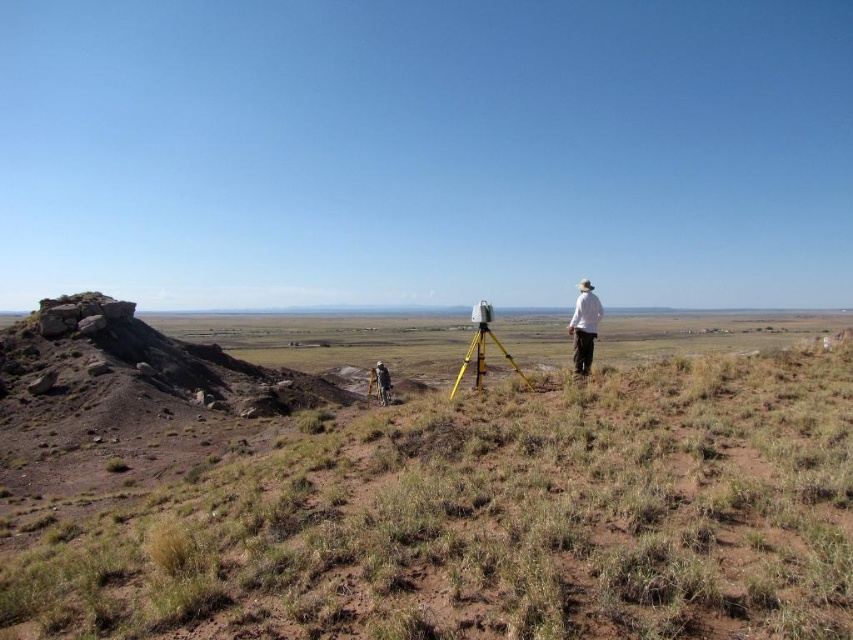
Can you confirm if dry grass at center is smaller than white matte shirt at right?

Actually, dry grass at center might be larger than white matte shirt at right.

Which is above, dry grass at center or white matte shirt at right?

white matte shirt at right is higher up.

You are a GUI agent. You are given a task and a screenshot of the screen. Output one action in this format:
    pyautogui.click(x=<x>, y=<y>)
    Task: Click on the dry grass at center
    The image size is (853, 640).
    Given the screenshot: What is the action you would take?
    pyautogui.click(x=416, y=497)

This screenshot has height=640, width=853. In order to click on dry grass at center in this screenshot , I will do `click(416, 497)`.

Between dry grass at center and yellow metallic tripod at center, which one has less height?

With less height is yellow metallic tripod at center.

Which is in front, point (337, 627) or point (483, 356)?

Point (337, 627)

This screenshot has height=640, width=853. In order to click on dry grass at center in this screenshot , I will do `click(416, 497)`.

Looking at this image, is the position of white matte shirt at right more distant than that of brushed metal tripod at lower center?

That is False.

Can you confirm if white matte shirt at right is bigger than brushed metal tripod at lower center?

Actually, white matte shirt at right might be smaller than brushed metal tripod at lower center.

Who is more forward, (595, 317) or (383, 394)?

Point (595, 317) is more forward.

The image size is (853, 640). Find the location of `white matte shirt at right`. white matte shirt at right is located at coordinates (584, 326).